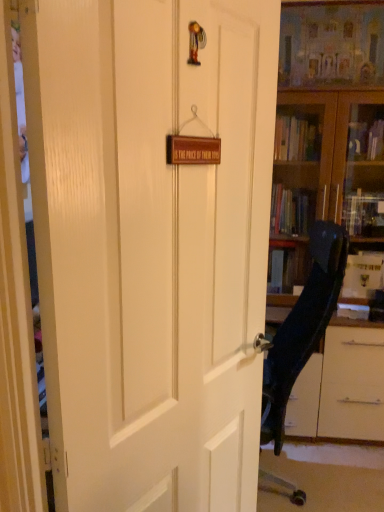
Question: Are black plastic chair at right and wooden bookcase at right located far from each other?

Choices:
 (A) no
 (B) yes

Answer: (A)

Question: Considering the relative positions of black plastic chair at right and wooden bookcase at right in the image provided, is black plastic chair at right behind wooden bookcase at right?

Choices:
 (A) yes
 (B) no

Answer: (B)

Question: Is black plastic chair at right positioned beyond the bounds of wooden bookcase at right?

Choices:
 (A) yes
 (B) no

Answer: (A)

Question: Is black plastic chair at right facing away from wooden bookcase at right?

Choices:
 (A) yes
 (B) no

Answer: (B)

Question: From a real-world perspective, is black plastic chair at right over wooden bookcase at right?

Choices:
 (A) yes
 (B) no

Answer: (B)

Question: In terms of height, does white matte door at center look taller or shorter compared to black plastic chair at right?

Choices:
 (A) tall
 (B) short

Answer: (A)

Question: Considering the positions of point (59, 55) and point (281, 328), is point (59, 55) closer or farther from the camera than point (281, 328)?

Choices:
 (A) farther
 (B) closer

Answer: (B)

Question: In the image, is white matte door at center on the left side or the right side of black plastic chair at right?

Choices:
 (A) right
 (B) left

Answer: (B)

Question: Considering their positions, is white matte door at center located in front of or behind black plastic chair at right?

Choices:
 (A) behind
 (B) front

Answer: (B)

Question: Is black plastic chair at right inside the boundaries of white matte door at center, or outside?

Choices:
 (A) outside
 (B) inside

Answer: (A)

Question: Is point (294, 324) positioned closer to the camera than point (69, 398)?

Choices:
 (A) closer
 (B) farther

Answer: (B)

Question: From a real-world perspective, relative to white matte door at center, is black plastic chair at right vertically above or below?

Choices:
 (A) above
 (B) below

Answer: (B)

Question: Considering the positions of black plastic chair at right and white matte door at center in the image, is black plastic chair at right wider or thinner than white matte door at center?

Choices:
 (A) wide
 (B) thin

Answer: (A)

Question: From the image's perspective, is wooden bookcase at right above or below black plastic chair at right?

Choices:
 (A) below
 (B) above

Answer: (B)

Question: Is wooden bookcase at right bigger or smaller than black plastic chair at right?

Choices:
 (A) big
 (B) small

Answer: (A)